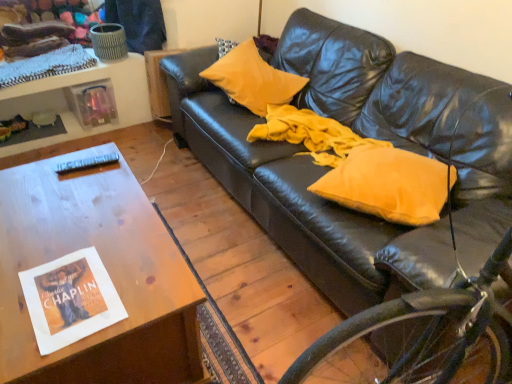
The width and height of the screenshot is (512, 384). In order to click on vacant space behind white paper magazine at lower left in this screenshot , I will do `click(93, 230)`.